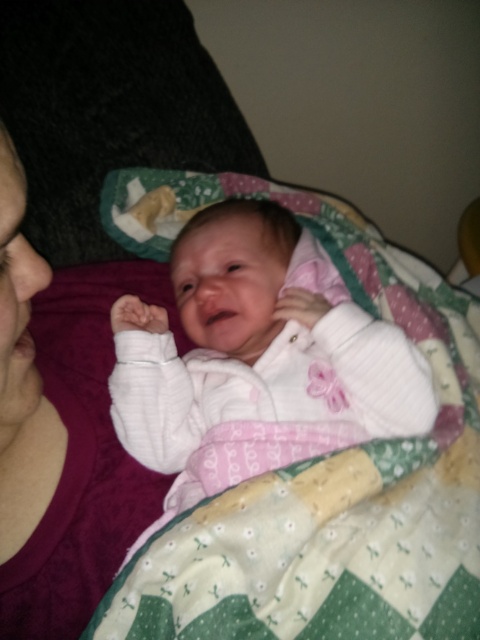
Question: Which point is closer to the camera?

Choices:
 (A) (285, 416)
 (B) (13, 502)

Answer: (B)

Question: Among these objects, which one is farthest from the camera?

Choices:
 (A) white soft baby at center
 (B) matte purple fabric at left

Answer: (A)

Question: Can you confirm if white soft baby at center is positioned below matte purple fabric at left?

Choices:
 (A) yes
 (B) no

Answer: (B)

Question: Does white soft baby at center appear on the left side of matte purple fabric at left?

Choices:
 (A) no
 (B) yes

Answer: (A)

Question: Can you confirm if white soft baby at center is positioned to the left of matte purple fabric at left?

Choices:
 (A) yes
 (B) no

Answer: (B)